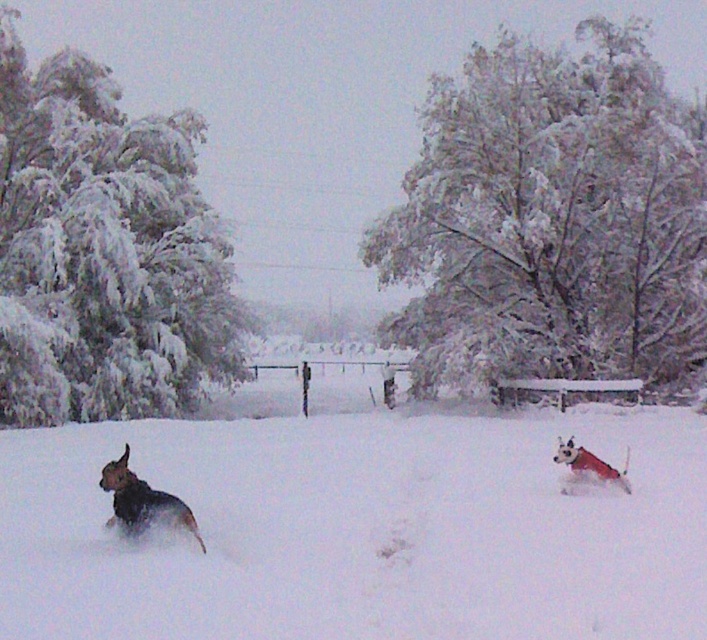
Which is behind, point (660, 499) or point (144, 508)?

The point (660, 499) is behind.

Who is taller, white fluffy snow at center or brown fur dog at lower left?

brown fur dog at lower left

At what (x,y) coordinates should I click in order to perform the action: click on white fluffy snow at center. Please return your answer as a coordinate pair (x, y). This screenshot has height=640, width=707. Looking at the image, I should click on (361, 531).

You are a GUI agent. You are given a task and a screenshot of the screen. Output one action in this format:
    pyautogui.click(x=<x>, y=<y>)
    Task: Click on the white fluffy snow at center
    
    Given the screenshot: What is the action you would take?
    pyautogui.click(x=361, y=531)

Which is behind, point (513, 282) or point (209, 368)?

The point (209, 368) is more distant.

Where is `snow-covered tree at upper center`? snow-covered tree at upper center is located at coordinates (551, 218).

Which is behind, point (4, 28) or point (177, 499)?

The point (4, 28) is more distant.

Locate an element on the screen. This screenshot has width=707, height=640. white frosty tree at left is located at coordinates (103, 250).